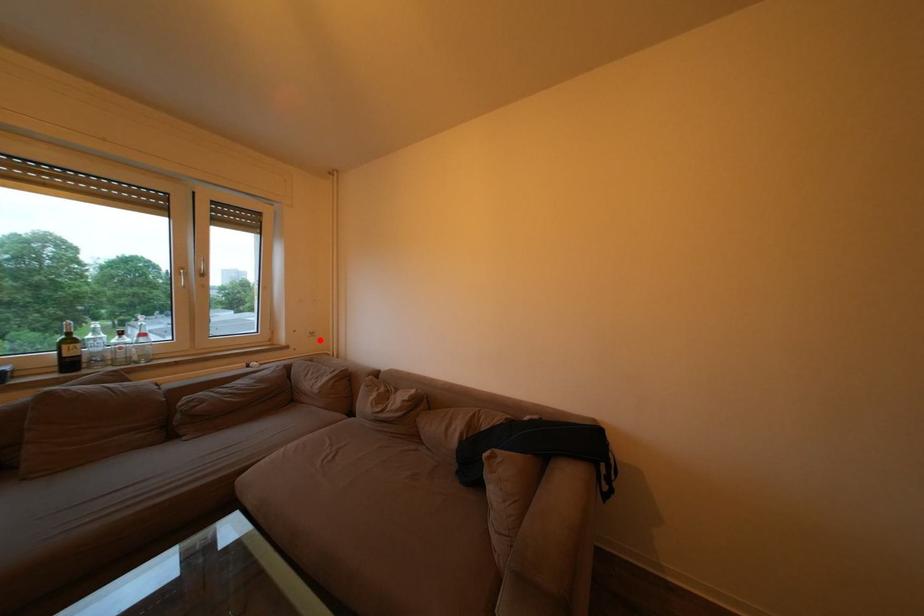
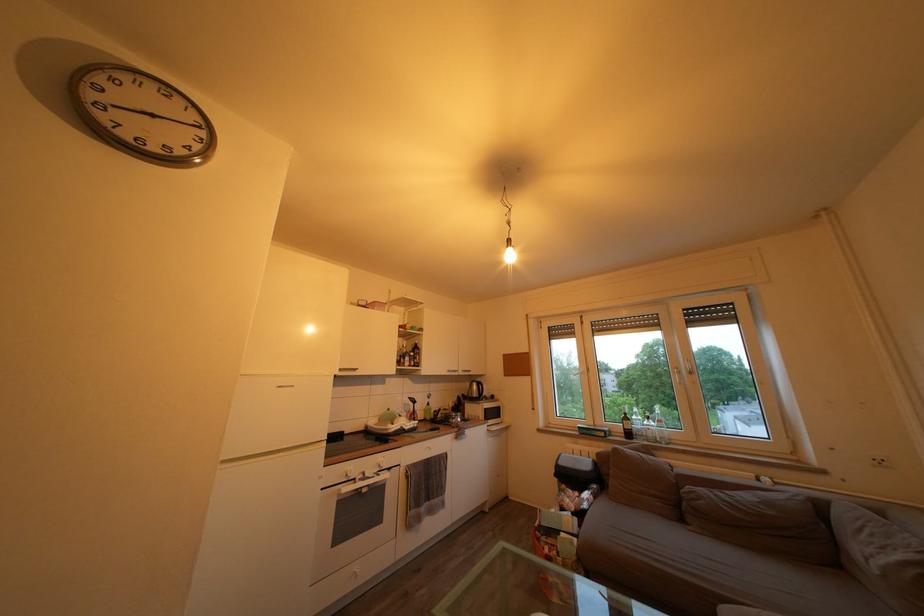
Question: I am providing you with two images of the same scene from different viewpoints. A red point is marked on the first image. Can you still see the location of the red point in image 2?

Choices:
 (A) Yes
 (B) No

Answer: (A)